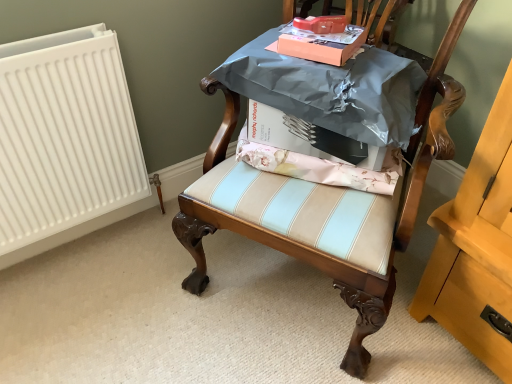
Question: Can you confirm if wooden chair at center is thinner than matte orange cardboard box at upper center, the 2th cardboard box positioned from the bottom?

Choices:
 (A) no
 (B) yes

Answer: (A)

Question: Is matte orange cardboard box at upper center, the first cardboard box in the top-to-bottom sequence, completely or partially inside wooden chair at center?

Choices:
 (A) no
 (B) yes

Answer: (B)

Question: Is wooden chair at center not inside matte orange cardboard box at upper center, the 2th cardboard box positioned from the bottom?

Choices:
 (A) no
 (B) yes

Answer: (B)

Question: Does wooden chair at center appear on the right side of matte orange cardboard box at upper center, the first cardboard box in the top-to-bottom sequence?

Choices:
 (A) no
 (B) yes

Answer: (A)

Question: Is wooden chair at center directly adjacent to matte orange cardboard box at upper center, the first cardboard box in the top-to-bottom sequence?

Choices:
 (A) no
 (B) yes

Answer: (A)

Question: Is the depth of wooden chair at center less than that of matte orange cardboard box at upper center, the first cardboard box in the top-to-bottom sequence?

Choices:
 (A) no
 (B) yes

Answer: (B)

Question: Can you confirm if white cardboard box at center, which is the 2th cardboard box from top to bottom, is taller than matte orange cardboard box at upper center, the 2th cardboard box positioned from the bottom?

Choices:
 (A) yes
 (B) no

Answer: (A)

Question: Considering the relative sizes of white cardboard box at center, which is the 2th cardboard box from top to bottom, and matte orange cardboard box at upper center, the 2th cardboard box positioned from the bottom, in the image provided, is white cardboard box at center, which is the 2th cardboard box from top to bottom, thinner than matte orange cardboard box at upper center, the 2th cardboard box positioned from the bottom,?

Choices:
 (A) no
 (B) yes

Answer: (A)

Question: Is white cardboard box at center, which ranks as the first cardboard box in bottom-to-top order, to the right of matte orange cardboard box at upper center, the 2th cardboard box positioned from the bottom, from the viewer's perspective?

Choices:
 (A) yes
 (B) no

Answer: (A)

Question: Is matte orange cardboard box at upper center, the first cardboard box in the top-to-bottom sequence, at the back of white cardboard box at center, which ranks as the first cardboard box in bottom-to-top order?

Choices:
 (A) yes
 (B) no

Answer: (B)

Question: Is white cardboard box at center, which is the 2th cardboard box from top to bottom, completely or partially outside of matte orange cardboard box at upper center, the first cardboard box in the top-to-bottom sequence?

Choices:
 (A) yes
 (B) no

Answer: (A)

Question: Is white cardboard box at center, which ranks as the first cardboard box in bottom-to-top order, positioned far away from matte orange cardboard box at upper center, the 2th cardboard box positioned from the bottom?

Choices:
 (A) yes
 (B) no

Answer: (B)

Question: Is the depth of matte orange cardboard box at upper center, the 2th cardboard box positioned from the bottom, less than that of white cardboard box at center, which is the 2th cardboard box from top to bottom?

Choices:
 (A) no
 (B) yes

Answer: (B)